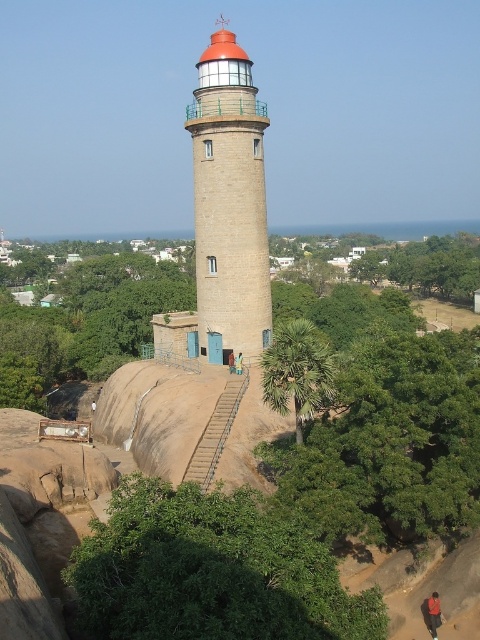
Is beige stone lighthouse at center above blue fabric person at center?

Correct, beige stone lighthouse at center is located above blue fabric person at center.

Can you confirm if beige stone lighthouse at center is shorter than blue fabric person at center?

Incorrect, beige stone lighthouse at center's height does not fall short of blue fabric person at center's.

Locate an element on the screen. beige stone lighthouse at center is located at coordinates (229, 202).

Is green leafy tree at lower center bigger than blue fabric person at center?

Correct, green leafy tree at lower center is larger in size than blue fabric person at center.

The width and height of the screenshot is (480, 640). I want to click on green leafy tree at lower center, so [x=211, y=572].

What do you see at coordinates (211, 572) in the screenshot? The width and height of the screenshot is (480, 640). I see `green leafy tree at lower center` at bounding box center [211, 572].

Find the location of a particular element. The image size is (480, 640). green leafy tree at lower center is located at coordinates (211, 572).

Who is more forward, (x=308, y=378) or (x=432, y=595)?

Point (x=432, y=595)

Is the position of green leafy palm at center more distant than that of dark red fabric pants at lower right?

Yes.

Describe the element at coordinates (298, 372) in the screenshot. I see `green leafy palm at center` at that location.

Identify the location of green leafy palm at center. The width and height of the screenshot is (480, 640). [x=298, y=372].